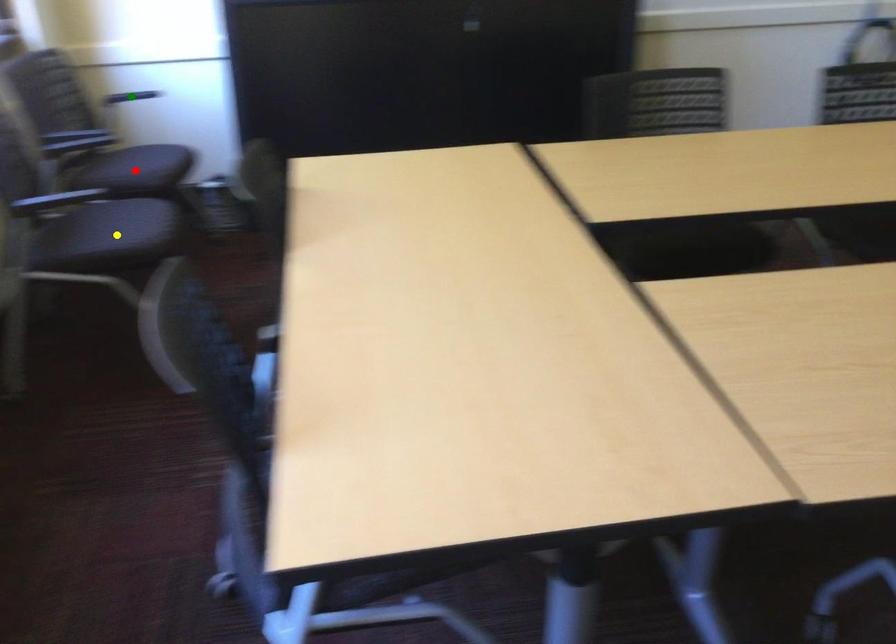
Order these from nearest to farthest:
A) red point
B) yellow point
C) green point

yellow point < red point < green point